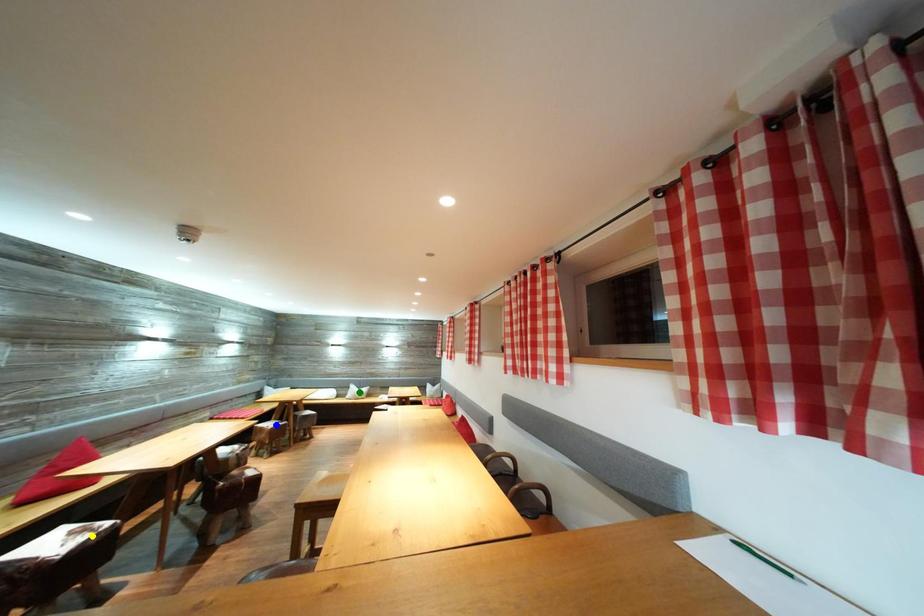
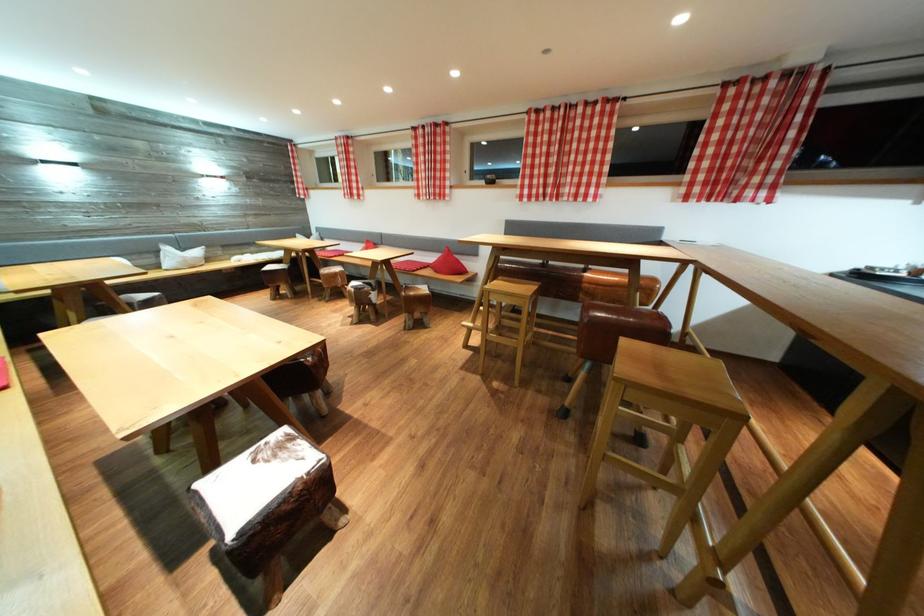
I am providing you with two images of the same scene from different viewpoints. Three points are marked in image1. Which point corresponds to a part or object that is occluded in image2?In image1, three points are marked. Which of them correspond to a part or object that is occluded in image2?Among the three points shown in image1, which one corresponds to a part or object that is no longer visible due to occlusion in image2?

blue point cannot be seen in image2.